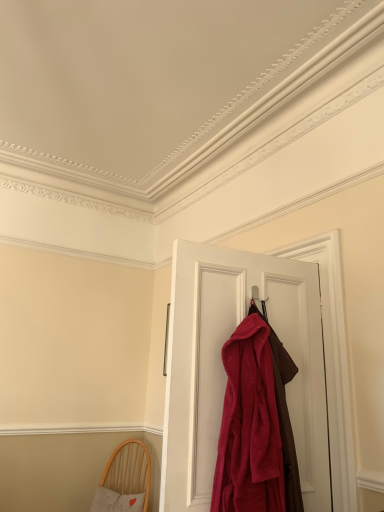
Find the location of a particular element. The image size is (384, 512). velvet red robe at center is located at coordinates (225, 372).

Is light wood chair with cushion at lower left bigger than velvet red robe at center?

Yes, light wood chair with cushion at lower left is bigger than velvet red robe at center.

Which is more to the left, light wood chair with cushion at lower left or velvet red robe at center?

light wood chair with cushion at lower left.

Locate an element on the screen. Image resolution: width=384 pixels, height=512 pixels. door in front of the light wood chair with cushion at lower left is located at coordinates (225, 372).

Which of these two, light wood chair with cushion at lower left or velvety red robe at center, is thinner?

With smaller width is velvety red robe at center.

From the picture: Considering the sizes of light wood chair with cushion at lower left and velvety red robe at center in the image, is light wood chair with cushion at lower left taller or shorter than velvety red robe at center?

light wood chair with cushion at lower left is shorter than velvety red robe at center.

Is light wood chair with cushion at lower left placed right next to velvety red robe at center?

light wood chair with cushion at lower left is not next to velvety red robe at center, and they're not touching.

From the image's perspective, between velvet red robe at center and light wood chair with cushion at lower left, who is located below?

light wood chair with cushion at lower left appears lower in the image.

Can light wood chair with cushion at lower left be found inside velvet red robe at center?

That's incorrect, light wood chair with cushion at lower left is not inside velvet red robe at center.

From a real-world perspective, is velvet red robe at center on light wood chair with cushion at lower left?

Yes, from a real-world perspective, velvet red robe at center is above light wood chair with cushion at lower left.

Is point (185, 487) more distant than point (97, 499)?

No, (185, 487) is in front of (97, 499).

Is the depth of velvet red robe at center less than that of velvety red robe at center?

That is False.

Which object is wider, velvet red robe at center or velvety red robe at center?

With larger width is velvety red robe at center.

Can you confirm if velvet red robe at center is positioned to the left of velvety red robe at center?

In fact, velvet red robe at center is to the right of velvety red robe at center.

I want to click on door that is above the velvety red robe at center (from the image's perspective), so click(225, 372).

From the image's perspective, is velvety red robe at center above or below velvet red robe at center?

velvety red robe at center is situated lower than velvet red robe at center in the image.

Is velvety red robe at center behind velvet red robe at center?

No, velvety red robe at center is closer to the viewer.

Which is more to the left, velvety red robe at center or velvet red robe at center?

velvety red robe at center is more to the left.

Is point (288, 502) farther from camera compared to point (122, 444)?

No, it is not.

From a real-world perspective, is velvety red robe at center physically located above or below light wood chair with cushion at lower left?

Clearly, from a real-world perspective, velvety red robe at center is above light wood chair with cushion at lower left.

Is velvety red robe at center to the left of light wood chair with cushion at lower left from the viewer's perspective?

Incorrect, velvety red robe at center is not on the left side of light wood chair with cushion at lower left.

From the image's perspective, would you say velvety red robe at center is positioned over light wood chair with cushion at lower left?

Correct, velvety red robe at center appears higher than light wood chair with cushion at lower left in the image.

Locate an element on the screen. The width and height of the screenshot is (384, 512). furniture beneath the velvet red robe at center (from a real-world perspective) is located at coordinates (125, 480).

Identify the location of furniture on the left of velvety red robe at center. (125, 480).

Consider the image. Based on their spatial positions, is light wood chair with cushion at lower left or velvet red robe at center closer to velvety red robe at center?

velvet red robe at center lies closer to velvety red robe at center than the other object.

When comparing their distances from velvet red robe at center, does light wood chair with cushion at lower left or velvety red robe at center seem closer?

Based on the image, velvety red robe at center appears to be nearer to velvet red robe at center.

Looking at the image, which one is located closer to velvety red robe at center, velvet red robe at center or light wood chair with cushion at lower left?

Among the two, velvet red robe at center is located nearer to velvety red robe at center.

Based on their spatial positions, is velvety red robe at center or light wood chair with cushion at lower left closer to velvet red robe at center?

velvety red robe at center.

From the image, which object appears to be farther from light wood chair with cushion at lower left, velvet red robe at center or velvety red robe at center?

velvety red robe at center is further to light wood chair with cushion at lower left.

Looking at the image, which one is located further to light wood chair with cushion at lower left, velvety red robe at center or velvet red robe at center?

velvety red robe at center.

Locate an element on the screen. Image resolution: width=384 pixels, height=512 pixels. door between velvety red robe at center and light wood chair with cushion at lower left from front to back is located at coordinates click(225, 372).